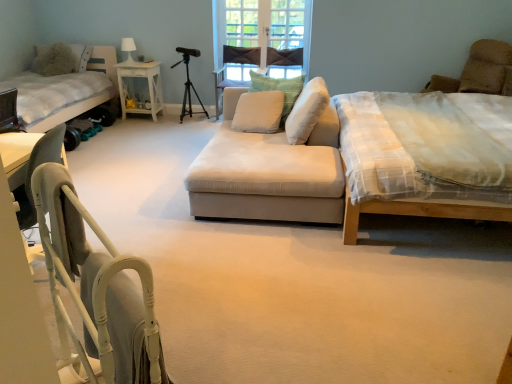
Question: From their relative heights in the image, would you say brown suede armchair at upper right is taller or shorter than white fabric bed at left, the second bed in the right-to-left sequence?

Choices:
 (A) short
 (B) tall

Answer: (A)

Question: Is brown suede armchair at upper right in front of or behind white fabric bed at left, the second bed in the right-to-left sequence, in the image?

Choices:
 (A) behind
 (B) front

Answer: (A)

Question: Which object is positioned closest to the white checkered fabric bed at right, the 2th bed from the left?

Choices:
 (A) brown suede armchair at upper right
 (B) beige fabric couch at center
 (C) white soft cushion at center, the second pillow when ordered from right to left
 (D) metallic tripod at center
 (E) fluffy white pillow at upper left, the 1th pillow viewed from the left

Answer: (A)

Question: Which object is the farthest from the fluffy white pillow at upper left, which appears as the fourth pillow when viewed from the right?

Choices:
 (A) white fabric bed at left, marked as the first bed in a left-to-right arrangement
 (B) white wood side table at center
 (C) white soft cushion at center, the third pillow from the left
 (D) brown suede armchair at upper right
 (E) metallic tripod at center

Answer: (D)